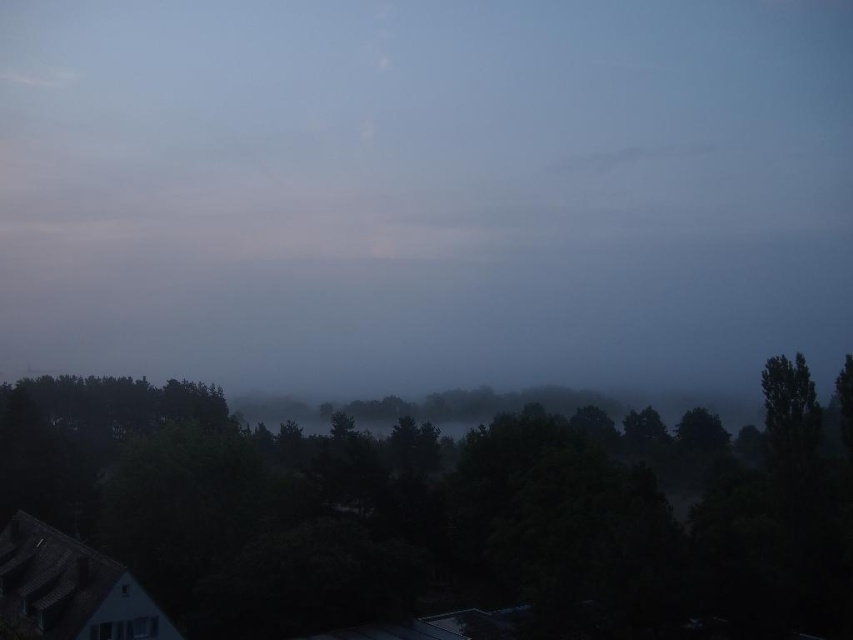
Question: Can you confirm if transparent mist at center is bigger than dark green leafy tree at center?

Choices:
 (A) no
 (B) yes

Answer: (B)

Question: Which point is closer to the camera taking this photo?

Choices:
 (A) (846, 268)
 (B) (252, 481)
 (C) (790, 403)

Answer: (C)

Question: Which object is closer to the camera taking this photo?

Choices:
 (A) transparent mist at center
 (B) dark green leafy tree at center
 (C) green matte tree at right

Answer: (B)

Question: Can you confirm if dark green leafy tree at center is positioned below green matte tree at right?

Choices:
 (A) no
 (B) yes

Answer: (B)

Question: Is transparent mist at center bigger than dark green leafy tree at center?

Choices:
 (A) yes
 (B) no

Answer: (A)

Question: Which point is closer to the camera?

Choices:
 (A) (805, 438)
 (B) (209, 67)

Answer: (A)